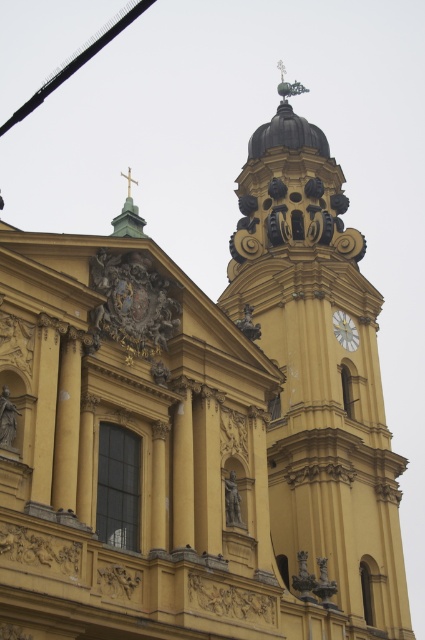
Question: Observing the image, what is the correct spatial positioning of yellow matte tower at upper right in reference to white marble clock at upper center?

Choices:
 (A) above
 (B) below

Answer: (A)

Question: Which point is closer to the camera taking this photo?

Choices:
 (A) (269, 132)
 (B) (336, 317)

Answer: (B)

Question: Is yellow matte tower at upper right below white marble clock at upper center?

Choices:
 (A) yes
 (B) no

Answer: (B)

Question: Can you confirm if yellow matte tower at upper right is bigger than white marble clock at upper center?

Choices:
 (A) no
 (B) yes

Answer: (B)

Question: Which point is farther to the camera?

Choices:
 (A) white marble clock at upper center
 (B) yellow matte tower at upper right

Answer: (A)

Question: Which of the following is the closest to the observer?

Choices:
 (A) yellow matte tower at upper right
 (B) white marble clock at upper center

Answer: (A)